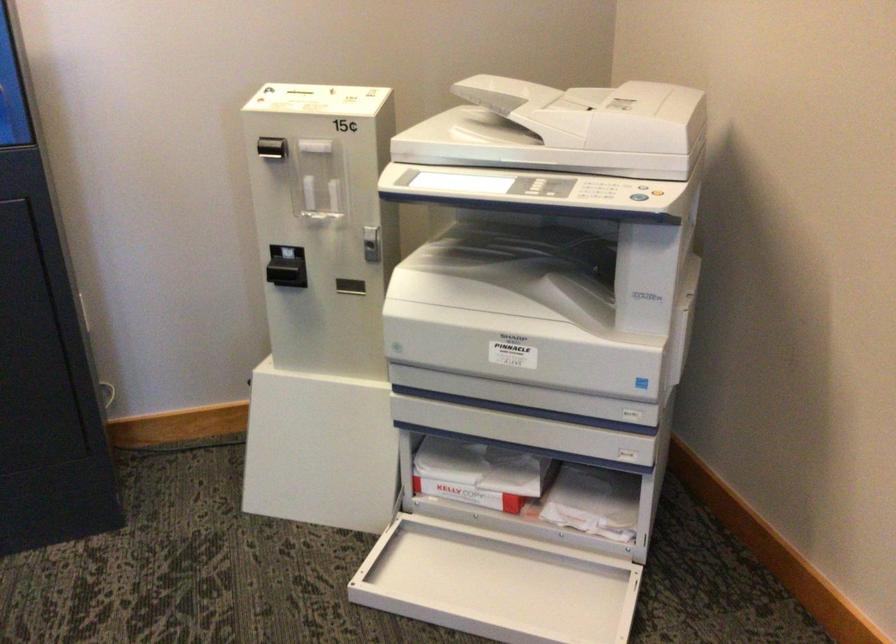
Where would you press the blue copier button? Please return your answer as a coordinate pair (x, y).

(643, 384)